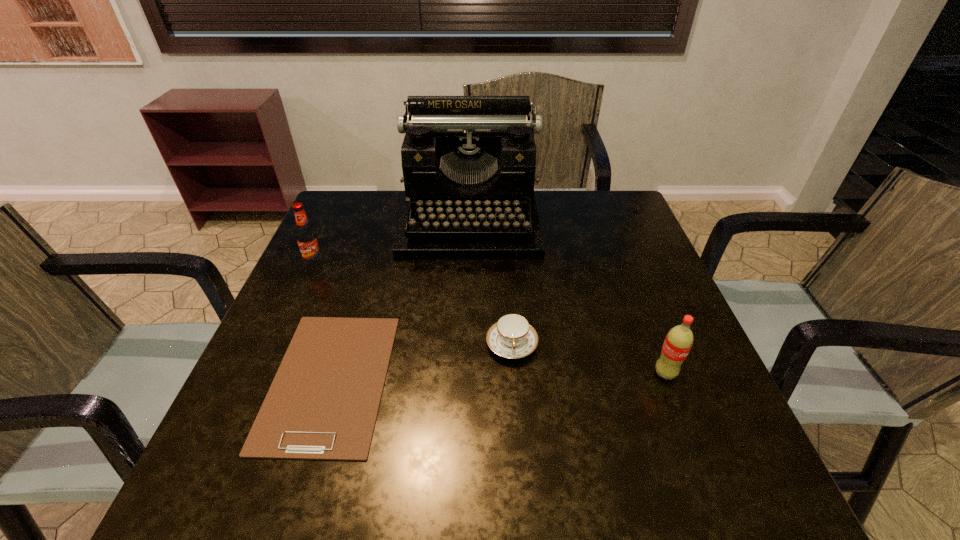
You are a GUI agent. You are given a task and a screenshot of the screen. Output one action in this format:
    pyautogui.click(x=<x>, y=<y>)
    Task: Click on the free location located 0.330m on the right of the shortest object
    
    Given the screenshot: What is the action you would take?
    pyautogui.click(x=563, y=379)

Locate an element on the screen. object that is at the far edge is located at coordinates (468, 162).

Find the location of a particular element. The height and width of the screenshot is (540, 960). object present at the near edge is located at coordinates (323, 403).

Locate an element on the screen. The width and height of the screenshot is (960, 540). root beer located in the left edge section of the desktop is located at coordinates (306, 236).

The height and width of the screenshot is (540, 960). I want to click on clipboard situated at the left edge, so click(323, 403).

Locate an element on the screen. Image resolution: width=960 pixels, height=540 pixels. object present at the right edge is located at coordinates (679, 340).

This screenshot has height=540, width=960. I want to click on object that is positioned at the near left corner, so click(x=323, y=403).

Find the location of `blank area at the far edge`. blank area at the far edge is located at coordinates (549, 212).

The image size is (960, 540). I want to click on vacant space at the near edge, so click(x=466, y=492).

The width and height of the screenshot is (960, 540). In the image, there is a desktop. What are the coordinates of `vacant region at the left edge` in the screenshot? It's located at (235, 411).